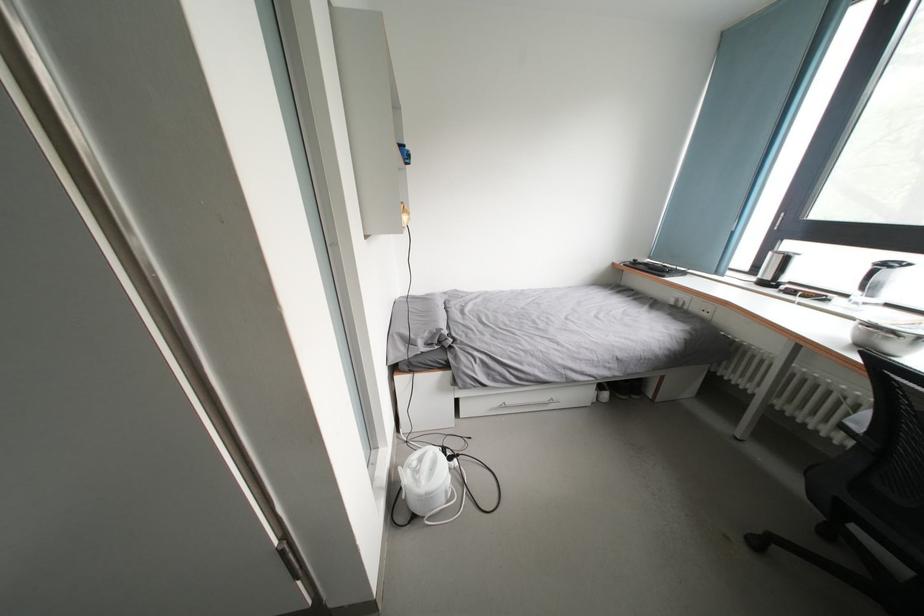
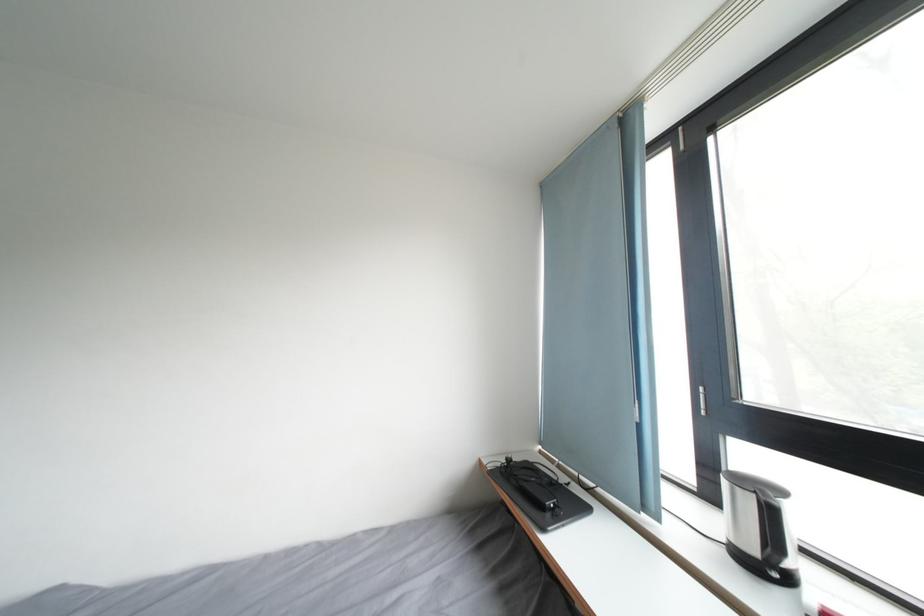
Where in the second image is the point corresponding to pixel 793 265 from the first image?

(776, 517)